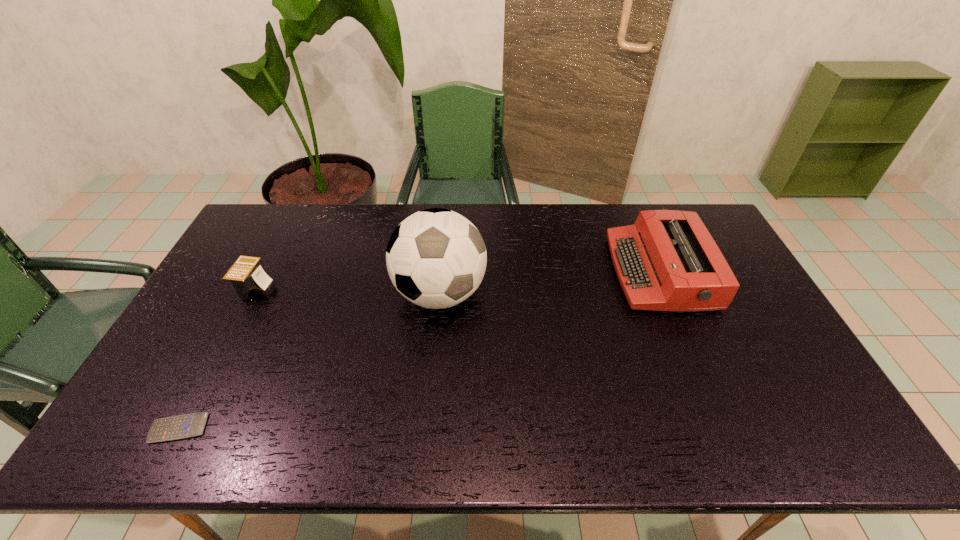
The height and width of the screenshot is (540, 960). In order to click on vacant space located on the typing side of the typewriter in this screenshot , I will do `click(490, 272)`.

The height and width of the screenshot is (540, 960). Find the location of `free space located 0.070m on the typing side of the typewriter`. free space located 0.070m on the typing side of the typewriter is located at coordinates (591, 272).

Where is `free location located on the right of the farther calculator`? free location located on the right of the farther calculator is located at coordinates (333, 289).

Find the location of a particular element. vacant area situated on the back of the nearer calculator is located at coordinates (247, 299).

Image resolution: width=960 pixels, height=540 pixels. I want to click on object at the far edge, so click(x=667, y=260).

The height and width of the screenshot is (540, 960). What are the coordinates of `object that is at the near edge` in the screenshot? It's located at (184, 426).

Find the location of a particular element. object situated at the right edge is located at coordinates (667, 260).

The width and height of the screenshot is (960, 540). Find the location of `object at the near left corner`. object at the near left corner is located at coordinates (184, 426).

Identify the location of object located in the far right corner section of the desktop. (667, 260).

The height and width of the screenshot is (540, 960). I want to click on free space at the far edge of the desktop, so click(372, 205).